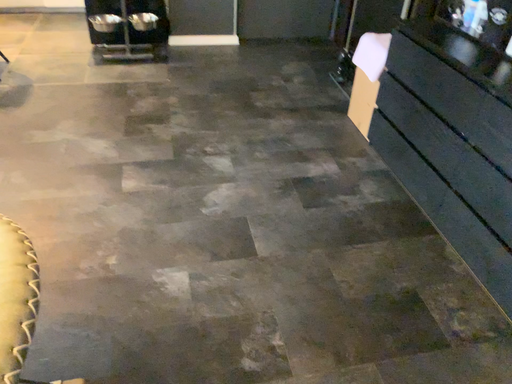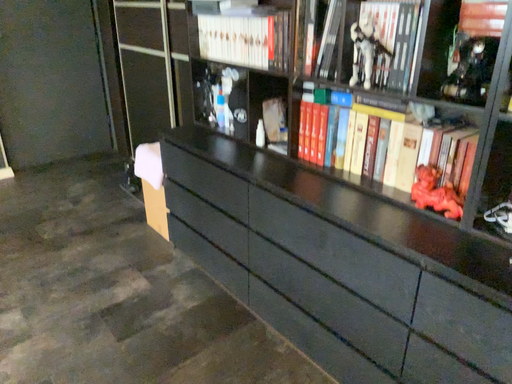
Question: How did the camera likely rotate when shooting the video?

Choices:
 (A) rotated right
 (B) rotated left

Answer: (A)